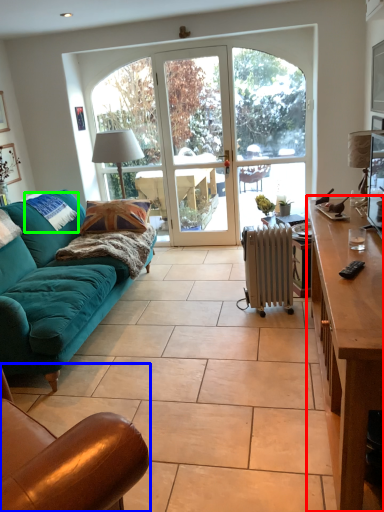
Question: Which is farther away from desk (highlighted by a red box)? chair (highlighted by a blue box) or pillow (highlighted by a green box)?

Choices:
 (A) chair
 (B) pillow

Answer: (B)